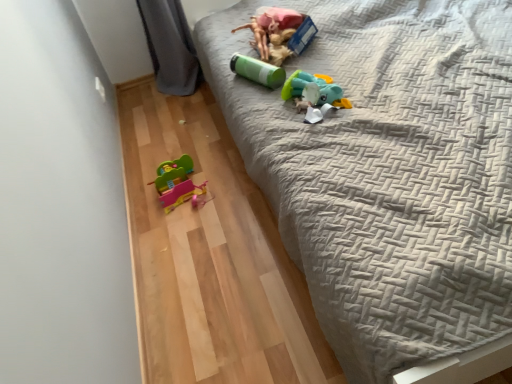
Identify the location of vacant space behind matte plastic toy car at lower left, which is counted as the 4th toy, starting from the top. (188, 148).